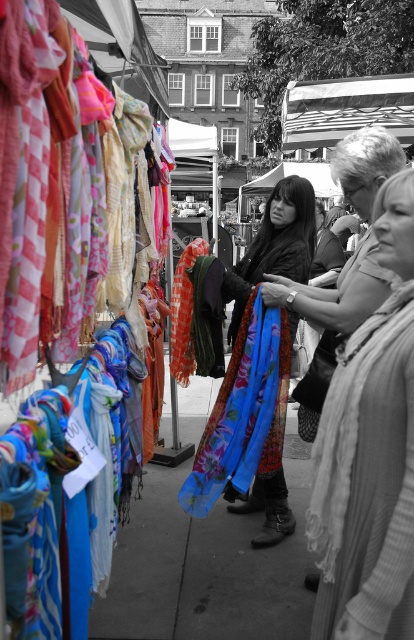
Question: Does knitted sweater at center appear on the right side of blue fabric at center?

Choices:
 (A) no
 (B) yes

Answer: (B)

Question: Which point appears closest to the camera in this image?

Choices:
 (A) (320, 401)
 (B) (293, 257)
 (C) (281, 532)

Answer: (A)

Question: Can you confirm if blue fabric at center is smaller than blue floral scarf at center?

Choices:
 (A) no
 (B) yes

Answer: (A)

Question: Can you confirm if blue fabric at center is bigger than textured gray scarf at right?

Choices:
 (A) no
 (B) yes

Answer: (B)

Question: Estimate the real-world distances between objects in this image. Which object is closer to the floral silk scarf at center?

Choices:
 (A) blue floral scarf at center
 (B) knitted sweater at center
 (C) blue fabric at center

Answer: (A)

Question: Which point appears closest to the camera in this image?

Choices:
 (A) (226, 580)
 (B) (296, 230)

Answer: (A)